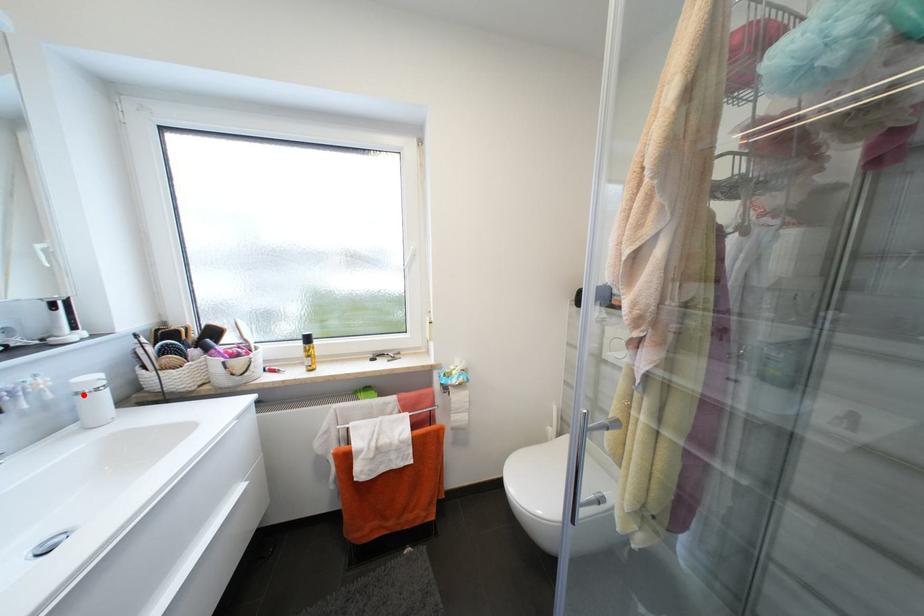
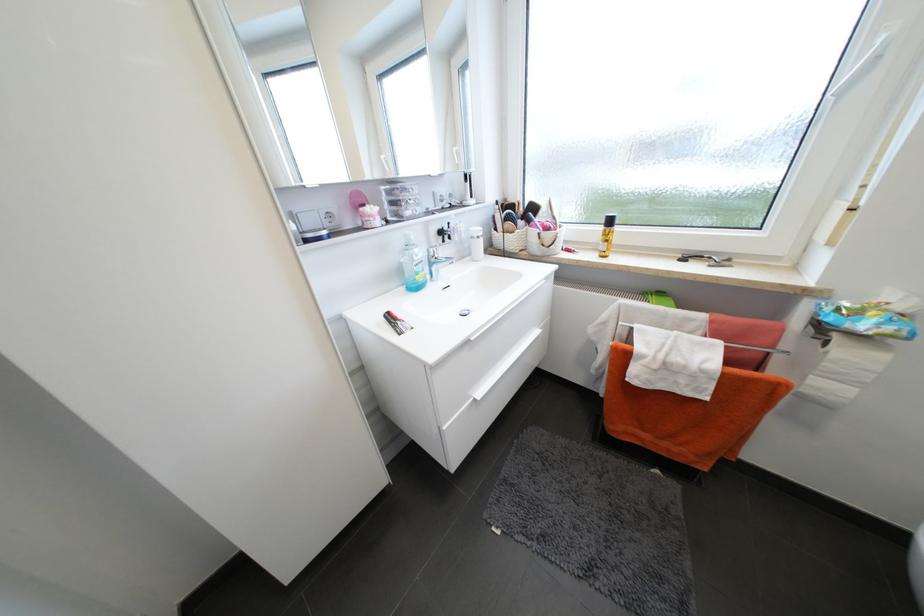
Question: I am providing you with two images of the same scene from different viewpoints. Image1 has a red point marked. In image2, the corresponding 3D location appears at what relative position? Reply with the corresponding letter.

Choices:
 (A) Closer
 (B) Farther

Answer: (A)